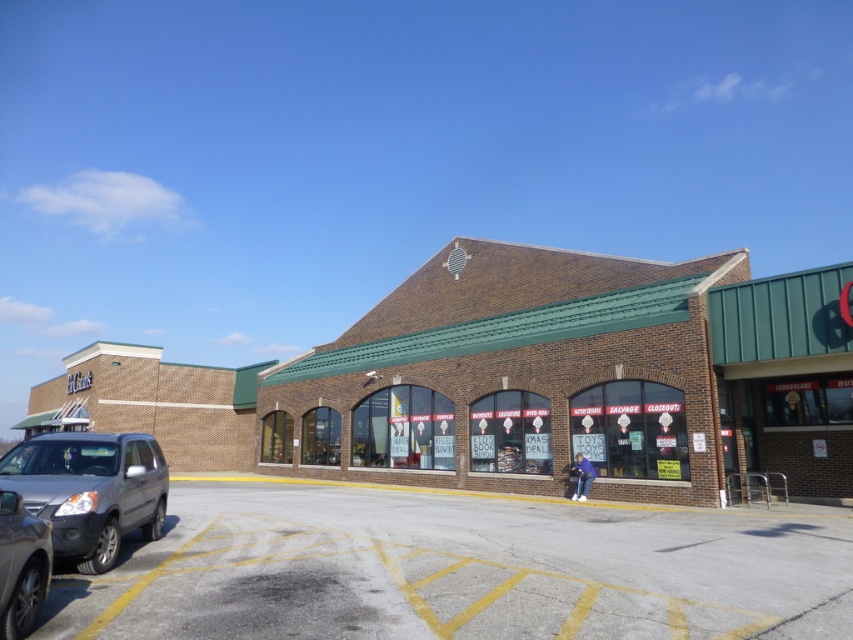
Question: Does gray asphalt parking lot at lower left appear under matte gray suv at lower left?

Choices:
 (A) no
 (B) yes

Answer: (B)

Question: Can you confirm if gray asphalt parking lot at lower left is wider than matte gray suv at lower left?

Choices:
 (A) no
 (B) yes

Answer: (B)

Question: Which point is farther to the camera?

Choices:
 (A) gray asphalt parking lot at lower left
 (B) matte gray suv at lower left

Answer: (B)

Question: Is matte gray suv at lower left thinner than satin silver sedan at lower left?

Choices:
 (A) yes
 (B) no

Answer: (B)

Question: Which point is closer to the camera taking this photo?

Choices:
 (A) coord(699,548)
 (B) coord(155,504)

Answer: (A)

Question: Which point is farther to the camera?

Choices:
 (A) matte gray suv at lower left
 (B) satin silver sedan at lower left
 (C) gray asphalt parking lot at lower left

Answer: (A)